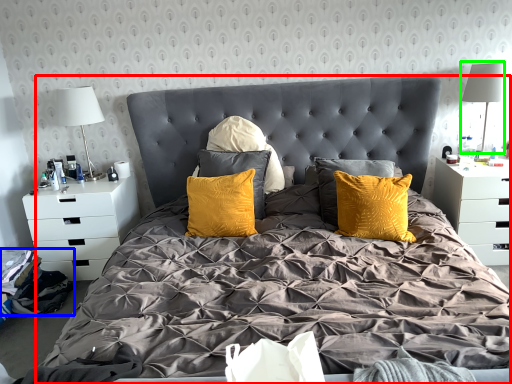
Question: Based on their relative distances, which object is farther from bed (highlighted by a red box)? Choose from material (highlighted by a blue box) and table lamp (highlighted by a green box).

Choices:
 (A) material
 (B) table lamp

Answer: (B)